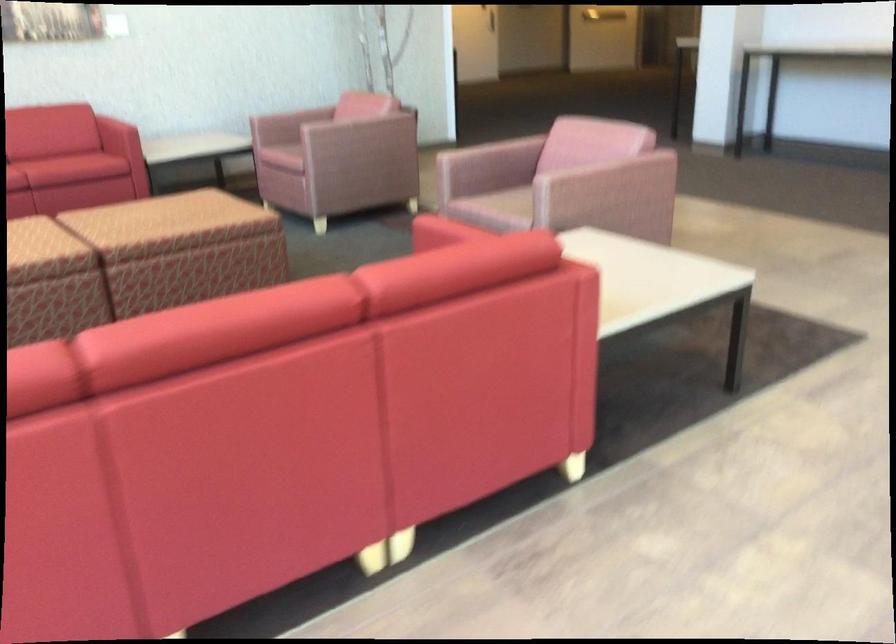
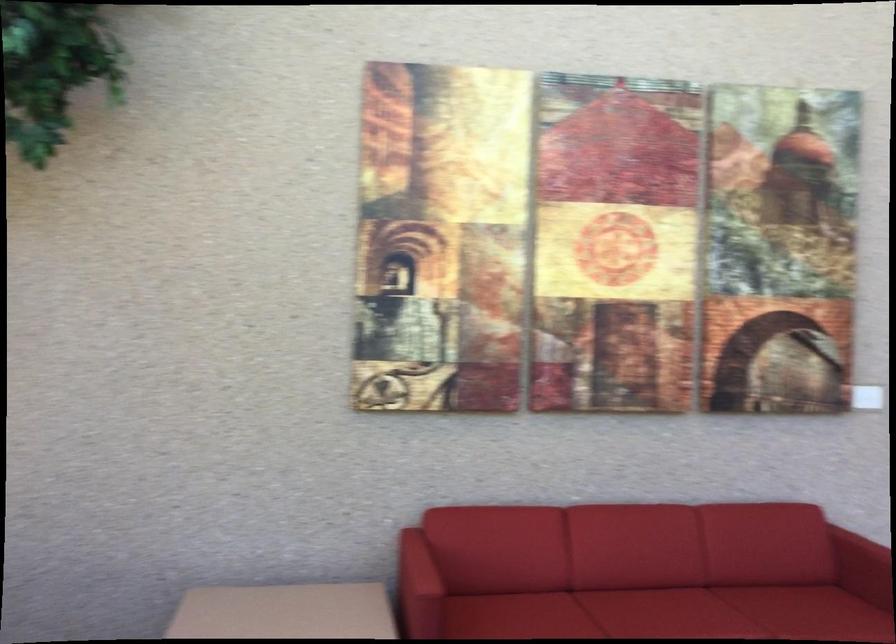
In the second image, find the point that corresponds to point (107, 107) in the first image.

(864, 558)